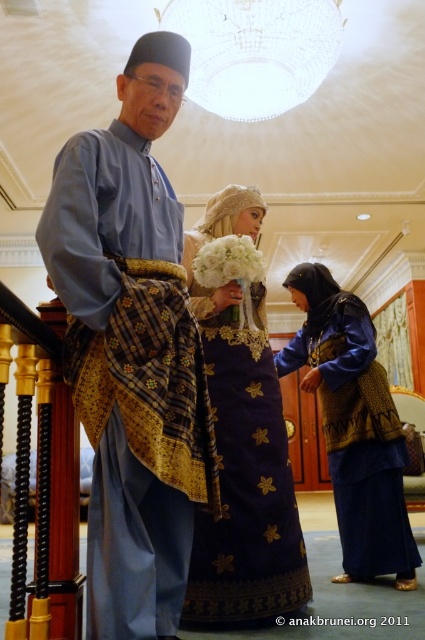
Is point (221, 472) positioned behind point (399, 573)?

No, (221, 472) is closer to viewer.

Does blue silk dress at center come in front of blue textured fabric dress at lower right?

Yes, it is.

At what (x,y) coordinates should I click in order to perform the action: click on blue silk dress at center. Please return your answer as a coordinate pair (x, y). Looking at the image, I should click on click(243, 445).

Locate an element on the screen. blue silk dress at center is located at coordinates (243, 445).

Is point (93, 300) positioned before point (294, 545)?

Yes, it is in front of point (294, 545).

Does matte blue shirt at center appear on the left side of blue silk dress at center?

Indeed, matte blue shirt at center is positioned on the left side of blue silk dress at center.

Is point (167, 115) positioned behind point (220, 288)?

No, (167, 115) is in front of (220, 288).

Where is `matte blue shirt at center`? matte blue shirt at center is located at coordinates (133, 349).

Is matte blue shirt at center taller than blue textured fabric dress at lower right?

Yes, matte blue shirt at center is taller than blue textured fabric dress at lower right.

Between matte blue shirt at center and blue textured fabric dress at lower right, which one has less height?

blue textured fabric dress at lower right is shorter.

What do you see at coordinates (133, 349) in the screenshot? I see `matte blue shirt at center` at bounding box center [133, 349].

In order to click on matte blue shirt at center in this screenshot , I will do `click(133, 349)`.